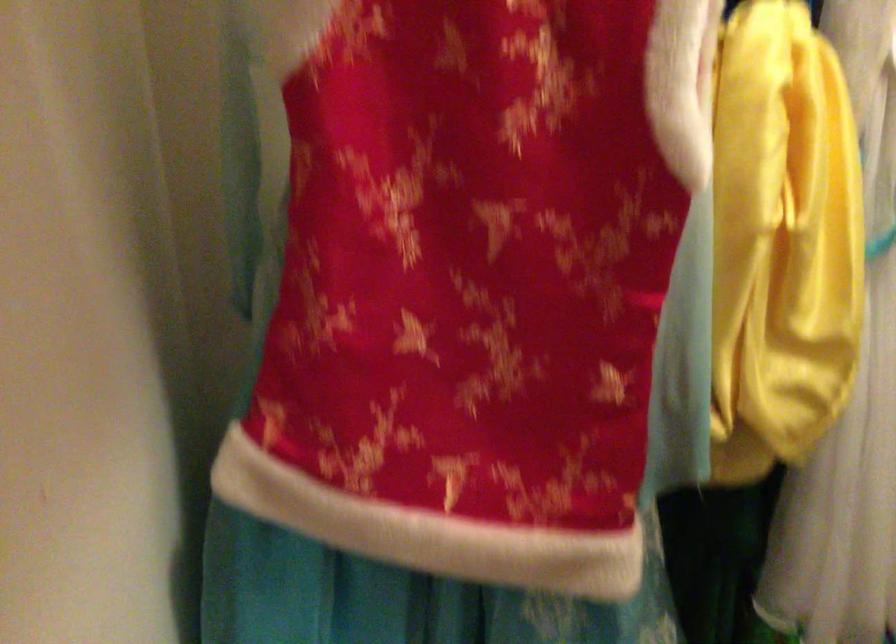
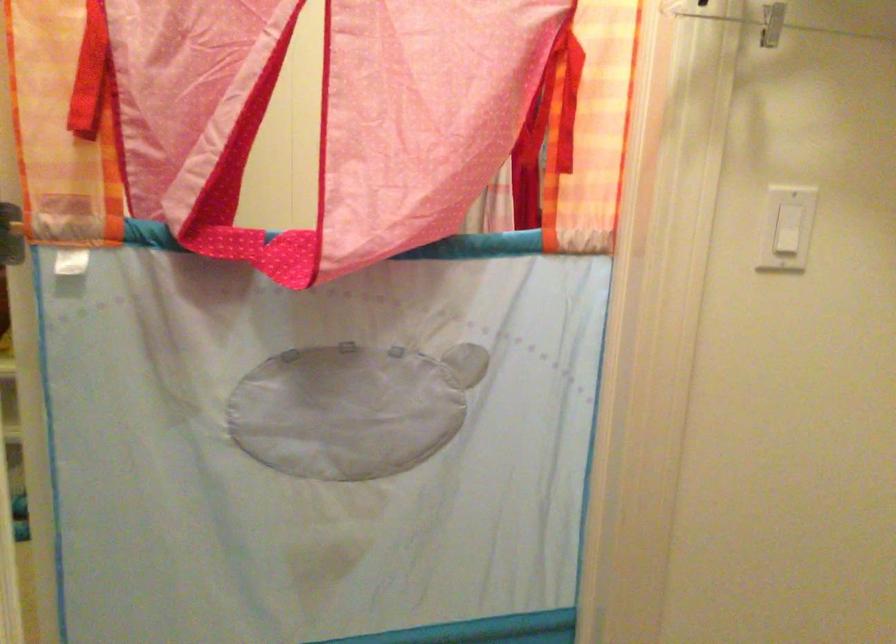
Question: Based on the continuous images, in which direction is the camera rotating? Reply with the corresponding letter.

Choices:
 (A) Left
 (B) Right
 (C) Up
 (D) Down

Answer: (B)